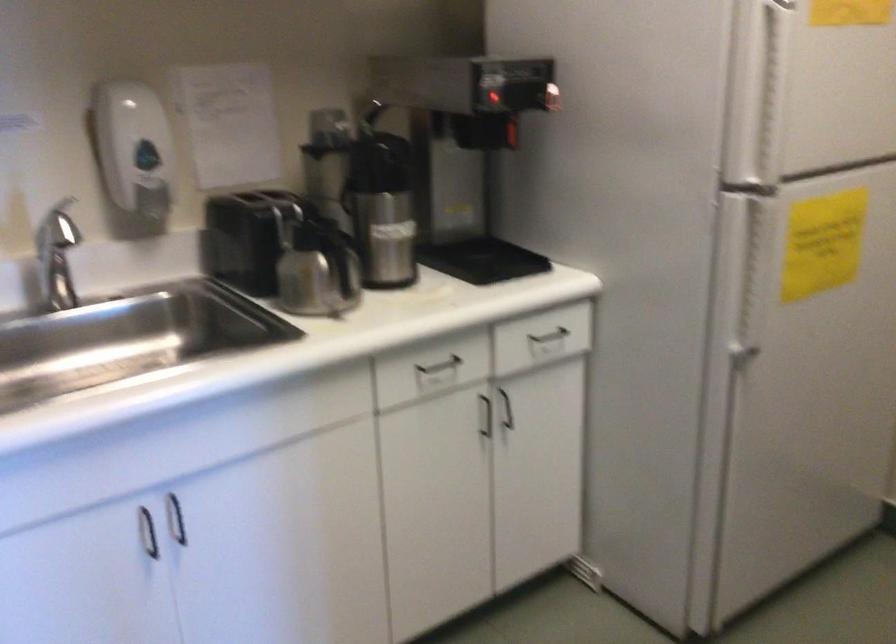
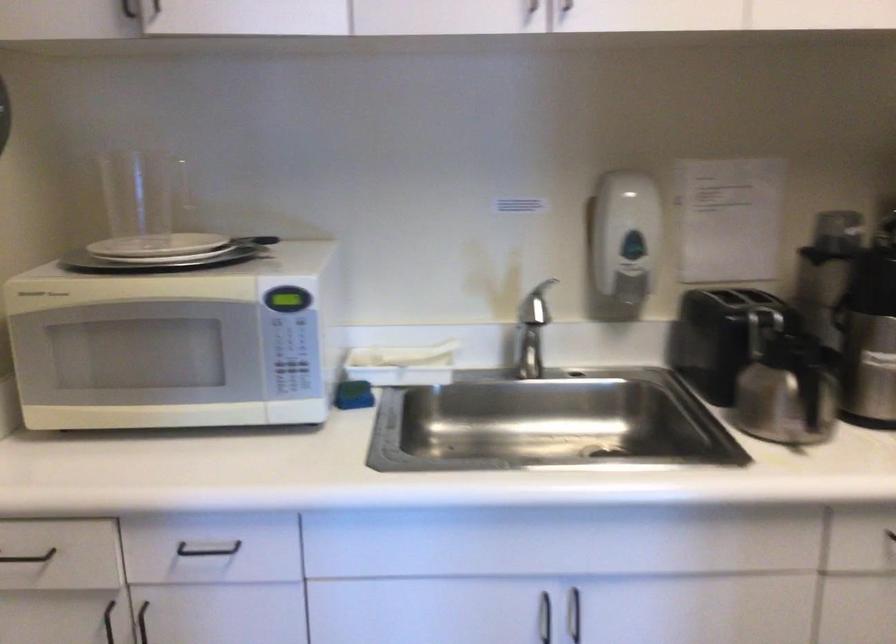
Question: Based on the continuous images, in which direction is the camera rotating? Reply with the corresponding letter.

Choices:
 (A) Left
 (B) Right
 (C) Up
 (D) Down

Answer: (A)